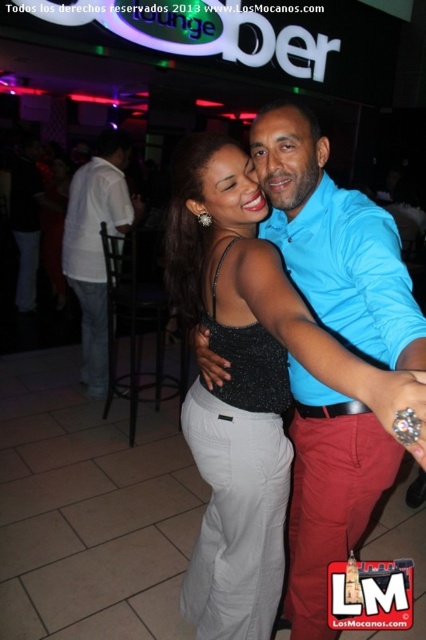
Question: Where is sparkly black tank top at center located in relation to white cotton shirt at left in the image?

Choices:
 (A) left
 (B) right

Answer: (B)

Question: In this image, where is blue cotton shirt at center located relative to sparkly black tank top at center?

Choices:
 (A) below
 (B) above

Answer: (B)

Question: Is blue cotton shirt at center thinner than sparkly black tank top at center?

Choices:
 (A) yes
 (B) no

Answer: (B)

Question: Which object is positioned farthest from the sparkly black tank top at center?

Choices:
 (A) blue cotton shirt at center
 (B) white cotton shirt at left

Answer: (B)

Question: Which of the following is the closest to the observer?

Choices:
 (A) white cotton shirt at left
 (B) blue cotton shirt at center

Answer: (B)

Question: Which of the following is the closest to the observer?

Choices:
 (A) (77, 275)
 (B) (284, 212)
 (C) (276, 496)

Answer: (C)